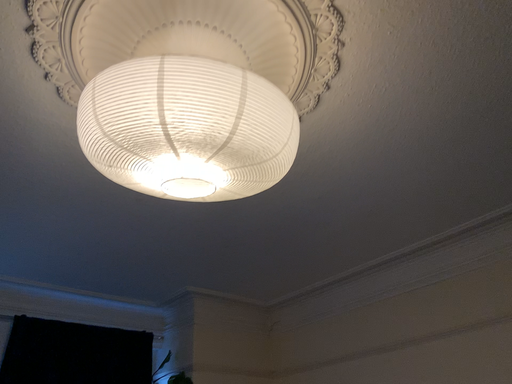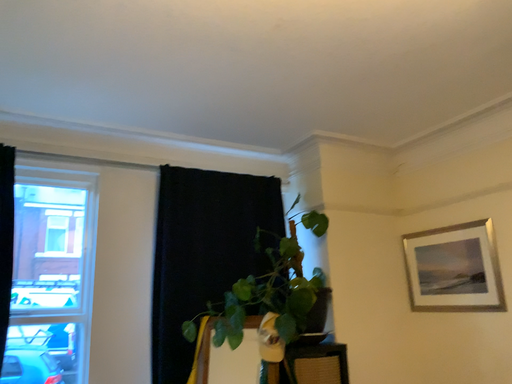
Question: Which way did the camera rotate in the video?

Choices:
 (A) rotated downward
 (B) rotated upward

Answer: (A)